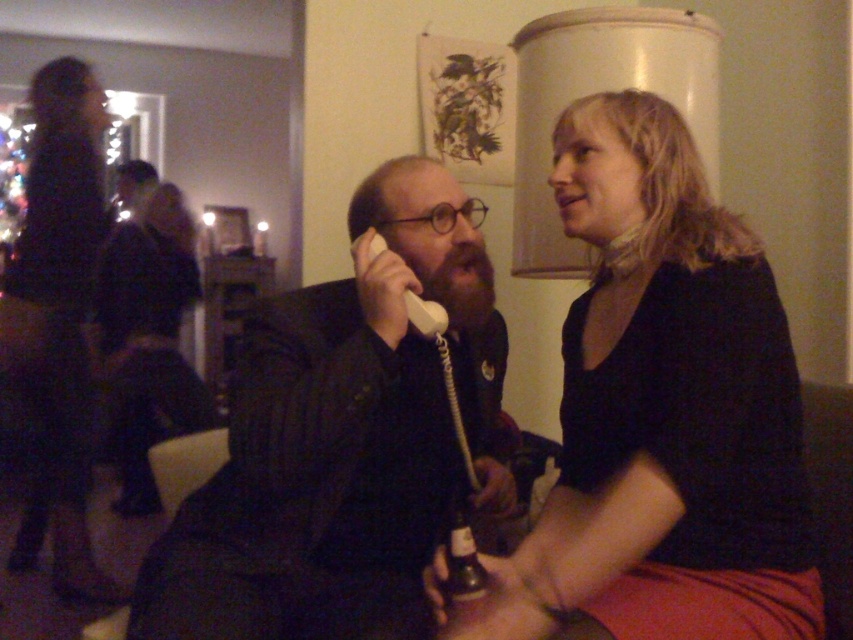
Question: Which object is positioned farthest from the matte black shirt at center?

Choices:
 (A) dark fabric dress at left
 (B) matte black phone at center

Answer: (A)

Question: Which of the following is the farthest from the observer?

Choices:
 (A) (67, 497)
 (B) (415, 250)
 (C) (744, 600)

Answer: (A)

Question: Can you confirm if matte black phone at center is positioned above dark fabric dress at left?

Choices:
 (A) no
 (B) yes

Answer: (A)

Question: Does matte black phone at center appear under dark fabric dress at left?

Choices:
 (A) yes
 (B) no

Answer: (A)

Question: Considering the relative positions of matte black shirt at center and matte black phone at center in the image provided, where is matte black shirt at center located with respect to matte black phone at center?

Choices:
 (A) left
 (B) right

Answer: (B)

Question: Among these objects, which one is farthest from the camera?

Choices:
 (A) matte black shirt at center
 (B) matte black phone at center
 (C) dark fabric dress at left

Answer: (C)